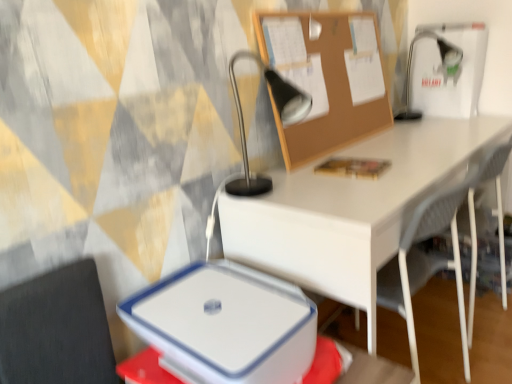
Question: From the image's perspective, is burlap corkboard at upper center located above or below metallic silver table lamp at upper center, which is counted as the first table lamp, starting from the left?

Choices:
 (A) above
 (B) below

Answer: (A)

Question: Considering their positions, is burlap corkboard at upper center located in front of or behind metallic silver table lamp at upper center, which is the 2th table lamp in back-to-front order?

Choices:
 (A) front
 (B) behind

Answer: (B)

Question: Which object is the farthest from the white plastic lunch box at lower center?

Choices:
 (A) white mesh chair at lower right
 (B) metallic silver table lamp at upper right, marked as the 1th table lamp in a back-to-front arrangement
 (C) metallic silver table lamp at upper center, which is counted as the first table lamp, starting from the left
 (D) burlap corkboard at upper center

Answer: (B)

Question: Which object is positioned closest to the metallic silver table lamp at upper right, marked as the 1th table lamp in a back-to-front arrangement?

Choices:
 (A) white mesh chair at lower right
 (B) metallic silver table lamp at upper center, which is the 2th table lamp in back-to-front order
 (C) burlap corkboard at upper center
 (D) white plastic lunch box at lower center

Answer: (C)